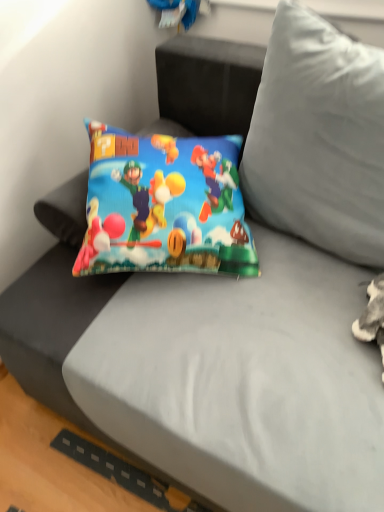
Where is `soft gray pillow at center`? soft gray pillow at center is located at coordinates (319, 138).

The height and width of the screenshot is (512, 384). What do you see at coordinates (319, 138) in the screenshot?
I see `soft gray pillow at center` at bounding box center [319, 138].

I want to click on soft gray pillow at center, so click(x=319, y=138).